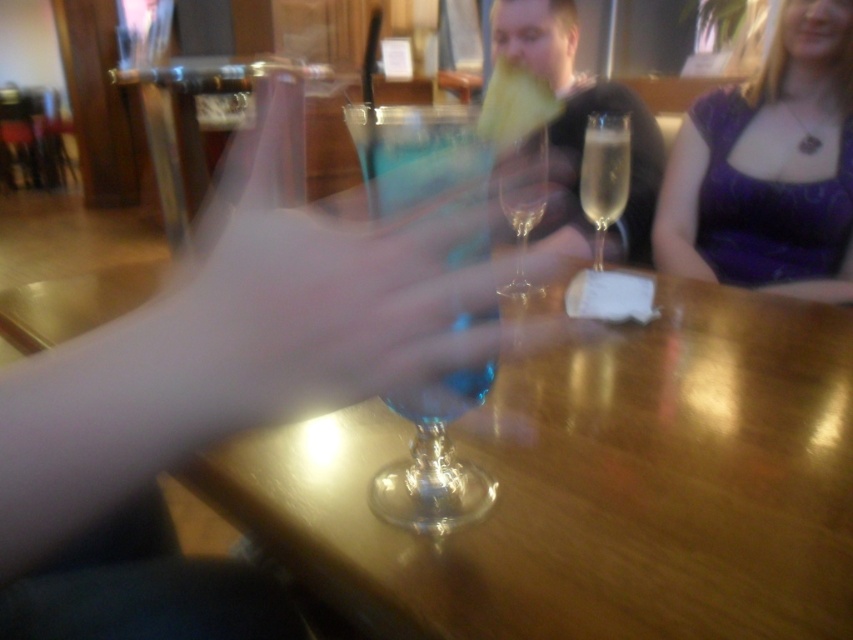
Does transparent glass at center lie in front of clear glass champagne flute at center?

That is True.

Does transparent glass at center have a smaller size compared to clear glass champagne flute at center?

Actually, transparent glass at center might be larger than clear glass champagne flute at center.

Find the location of `transparent glass at center`. transparent glass at center is located at coordinates (593, 488).

Can you confirm if transparent glass wine glass at center is positioned below clear glass wine glass at center?

Yes, transparent glass wine glass at center is below clear glass wine glass at center.

Between point (473, 252) and point (519, 196), which one is positioned behind?

Positioned behind is point (519, 196).

At what (x,y) coordinates should I click in order to perform the action: click on transparent glass wine glass at center. Please return your answer as a coordinate pair (x, y). The height and width of the screenshot is (640, 853). Looking at the image, I should click on (434, 461).

Where is `transparent glass wine glass at center`? This screenshot has height=640, width=853. transparent glass wine glass at center is located at coordinates tap(434, 461).

Which is behind, point (846, 29) or point (633, 99)?

The point (633, 99) is behind.

From the picture: Is purple fabric dress at upper right to the right of translucent glass champagne flute at center from the viewer's perspective?

Indeed, purple fabric dress at upper right is positioned on the right side of translucent glass champagne flute at center.

Which is behind, point (769, 256) or point (590, 93)?

The point (590, 93) is more distant.

This screenshot has width=853, height=640. I want to click on purple fabric dress at upper right, so click(x=769, y=170).